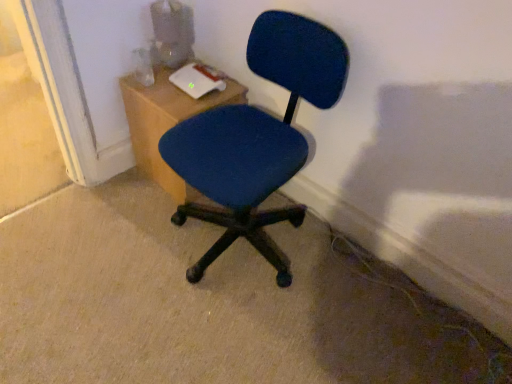
The height and width of the screenshot is (384, 512). Identify the location of vacant area that lies between wooden table at upper left and blue fabric chair at center. (148, 201).